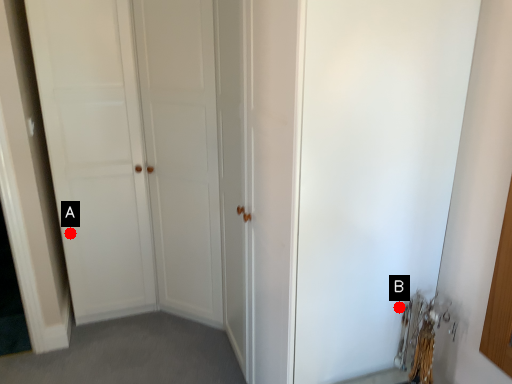
Question: Two points are circled on the image, labeled by A and B beside each circle. Which point is further to the camera?

Choices:
 (A) A is further
 (B) B is further

Answer: (A)